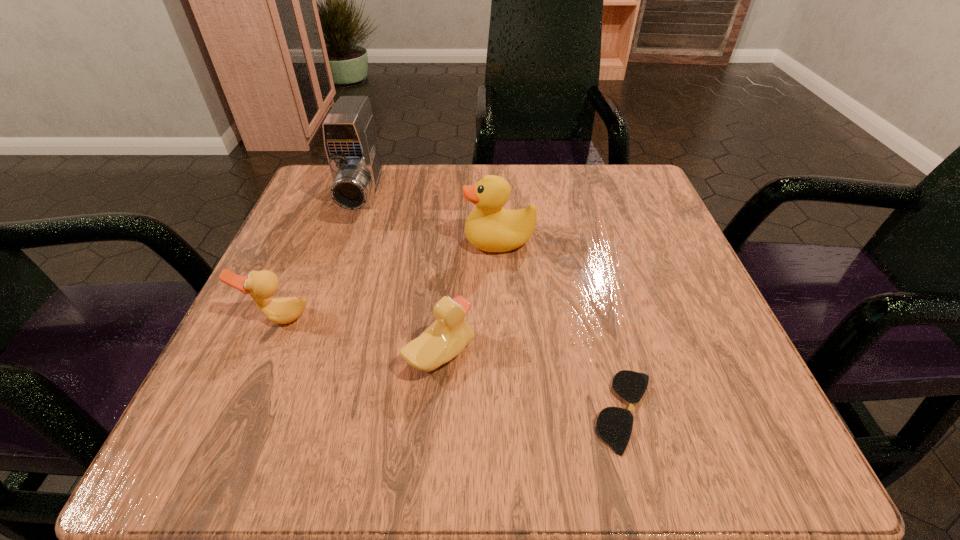
Where is `camcorder`? This screenshot has height=540, width=960. camcorder is located at coordinates (351, 143).

This screenshot has height=540, width=960. What are the coordinates of `the tallest duck` in the screenshot? It's located at click(489, 227).

I want to click on the fourth shortest object, so click(489, 227).

What are the coordinates of `the leftmost duck` in the screenshot? It's located at (261, 285).

You are a GUI agent. You are given a task and a screenshot of the screen. Output one action in this format:
    pyautogui.click(x=<x>, y=<y>)
    Task: Click on the shortest object
    
    Given the screenshot: What is the action you would take?
    pyautogui.click(x=614, y=425)

The width and height of the screenshot is (960, 540). Find the location of `spectacles`. spectacles is located at coordinates (614, 425).

Where is `vacant space located 0.380m at the front of the tallest object, highlighting the lens`? vacant space located 0.380m at the front of the tallest object, highlighting the lens is located at coordinates tap(292, 408).

Where is `vacant area located 0.050m at the beak of the farthest duck`? vacant area located 0.050m at the beak of the farthest duck is located at coordinates (438, 241).

Identify the location of vacant space located 0.120m at the beak of the farthest duck. click(x=400, y=241).

Where is `vacant area situated 0.330m at the beak of the farthest duck`? This screenshot has height=540, width=960. vacant area situated 0.330m at the beak of the farthest duck is located at coordinates (287, 241).